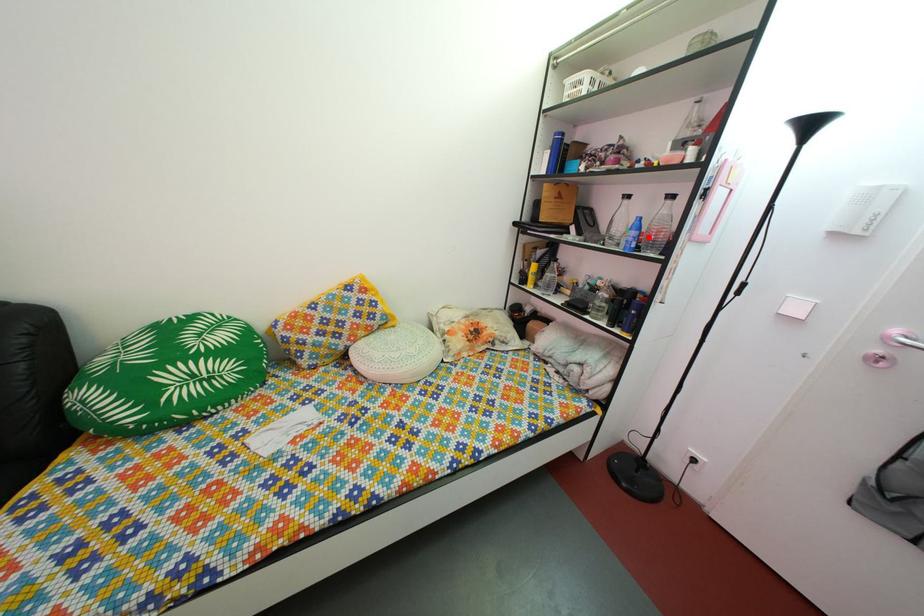
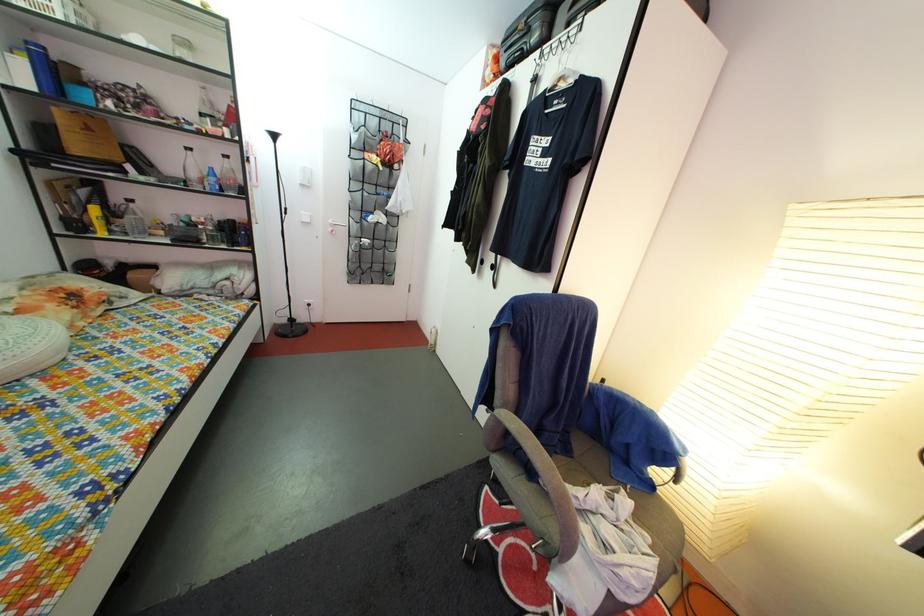
In the second image, find the point that corresponds to the highlighted location in the first image.

(225, 185)